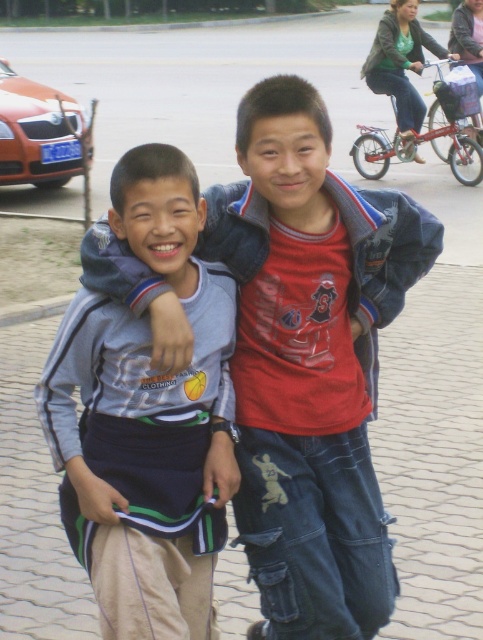
Is matte gray hoodie at center above gray fabric shirt at left?

Yes, matte gray hoodie at center is above gray fabric shirt at left.

Is point (332, 275) behind point (108, 372)?

That is True.

Find the location of a particular element. matte gray hoodie at center is located at coordinates (311, 362).

Does gray fabric shirt at left have a greater width compared to denim jacket at upper right?

No.

Is gray fabric shirt at left taller than denim jacket at upper right?

No.

Where is `gray fabric shirt at left`? The height and width of the screenshot is (640, 483). gray fabric shirt at left is located at coordinates (147, 412).

Which is behind, point (241, 522) or point (423, 109)?

Positioned behind is point (423, 109).

Can you confirm if matte gray hoodie at center is positioned below denim jacket at upper right?

Yes, matte gray hoodie at center is below denim jacket at upper right.

Does point (310, 464) lie in front of point (408, 116)?

Yes.

The height and width of the screenshot is (640, 483). What are the coordinates of `matte gray hoodie at center` in the screenshot? It's located at 311,362.